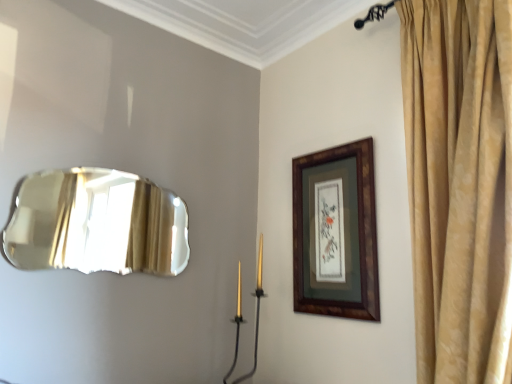
Question: From the image's perspective, is wooden frame at upper right on top of shiny metallic mirror at left?

Choices:
 (A) no
 (B) yes

Answer: (A)

Question: From a real-world perspective, is wooden frame at upper right below shiny metallic mirror at left?

Choices:
 (A) no
 (B) yes

Answer: (B)

Question: Is shiny metallic mirror at left at the back of wooden frame at upper right?

Choices:
 (A) no
 (B) yes

Answer: (A)

Question: Would you say wooden frame at upper right is a long distance from shiny metallic mirror at left?

Choices:
 (A) yes
 (B) no

Answer: (B)

Question: From a real-world perspective, is wooden frame at upper right on shiny metallic mirror at left?

Choices:
 (A) no
 (B) yes

Answer: (A)

Question: Can you confirm if wooden frame at upper right is wider than shiny metallic mirror at left?

Choices:
 (A) no
 (B) yes

Answer: (A)

Question: Is shiny metallic mirror at left bigger than wooden frame at upper right?

Choices:
 (A) no
 (B) yes

Answer: (B)

Question: Are shiny metallic mirror at left and wooden frame at upper right located far from each other?

Choices:
 (A) no
 (B) yes

Answer: (A)

Question: Can you confirm if shiny metallic mirror at left is shorter than wooden frame at upper right?

Choices:
 (A) yes
 (B) no

Answer: (A)

Question: From the image's perspective, is shiny metallic mirror at left located beneath wooden frame at upper right?

Choices:
 (A) yes
 (B) no

Answer: (B)

Question: Is shiny metallic mirror at left further to the viewer compared to wooden frame at upper right?

Choices:
 (A) yes
 (B) no

Answer: (B)

Question: Could you tell me if shiny metallic mirror at left is turned towards wooden frame at upper right?

Choices:
 (A) yes
 (B) no

Answer: (B)

Question: Is the position of gold metallic candle holder at center less distant than that of shiny metallic mirror at left?

Choices:
 (A) no
 (B) yes

Answer: (A)